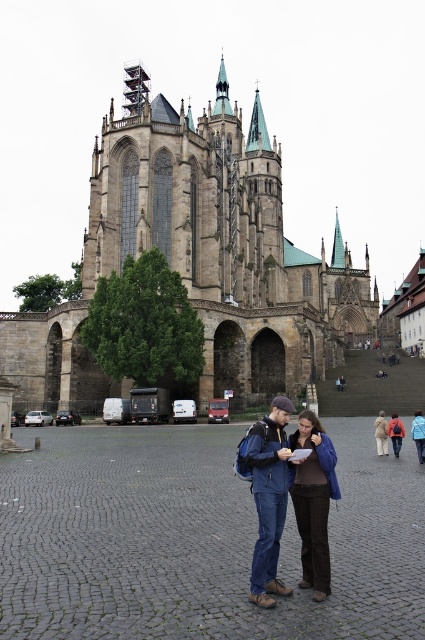
You are a tour guide explaining the cathedral to visitors. You notice two jackets left unattended on a bench in the plaza. The matte blue jacket at center and the brown leather jacket at center. Which jacket is taller in height?

The matte blue jacket at center is taller than the brown leather jacket at center.

You are standing in front of the cathedral and see two points marked on the plaza. The first point is at coordinates point (37,314) and the second point is at point (385,422). Which point is closer to you?

Point (37,314) is closer to you because it is further to the camera than point (385,422).